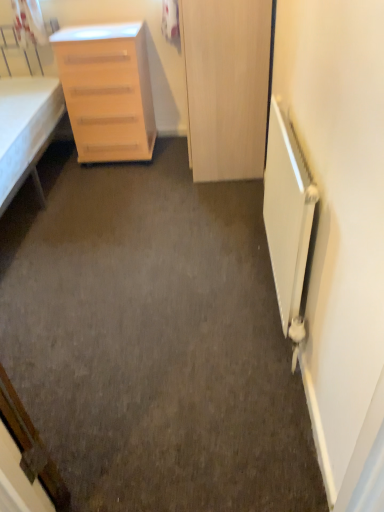
Question: Is light wood/finely finished chest of drawers at left further to the viewer compared to white fabric bed at left?

Choices:
 (A) no
 (B) yes

Answer: (B)

Question: Is light wood/finely finished chest of drawers at left thinner than white fabric bed at left?

Choices:
 (A) no
 (B) yes

Answer: (B)

Question: Can we say light wood/finely finished chest of drawers at left lies outside white fabric bed at left?

Choices:
 (A) yes
 (B) no

Answer: (A)

Question: From a real-world perspective, is light wood/finely finished chest of drawers at left beneath white fabric bed at left?

Choices:
 (A) yes
 (B) no

Answer: (A)

Question: Is light wood/finely finished chest of drawers at left oriented away from white fabric bed at left?

Choices:
 (A) no
 (B) yes

Answer: (A)

Question: Considering the relative sizes of light wood/finely finished chest of drawers at left and white fabric bed at left in the image provided, is light wood/finely finished chest of drawers at left taller than white fabric bed at left?

Choices:
 (A) yes
 (B) no

Answer: (B)

Question: Is white fabric bed at left further to the viewer compared to white matte radiator at right?

Choices:
 (A) yes
 (B) no

Answer: (A)

Question: Does white fabric bed at left have a lesser width compared to white matte radiator at right?

Choices:
 (A) yes
 (B) no

Answer: (B)

Question: From a real-world perspective, does white fabric bed at left sit lower than white matte radiator at right?

Choices:
 (A) yes
 (B) no

Answer: (B)

Question: From a real-world perspective, does white fabric bed at left stand above white matte radiator at right?

Choices:
 (A) yes
 (B) no

Answer: (A)

Question: Does white fabric bed at left appear on the right side of white matte radiator at right?

Choices:
 (A) no
 (B) yes

Answer: (A)

Question: Does white fabric bed at left have a larger size compared to white matte radiator at right?

Choices:
 (A) no
 (B) yes

Answer: (B)

Question: Considering the relative sizes of wooden door at center and light wood/finely finished chest of drawers at left in the image provided, is wooden door at center smaller than light wood/finely finished chest of drawers at left?

Choices:
 (A) no
 (B) yes

Answer: (A)